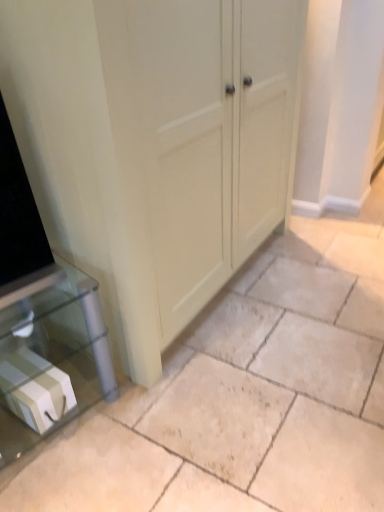
You are a GUI agent. You are given a task and a screenshot of the screen. Output one action in this format:
    pyautogui.click(x=<x>, y=<y>)
    Task: Click on the unoccupied area in front of matte cream cupboard at center
    This screenshot has height=512, width=384.
    Given the screenshot: What is the action you would take?
    pyautogui.click(x=238, y=396)